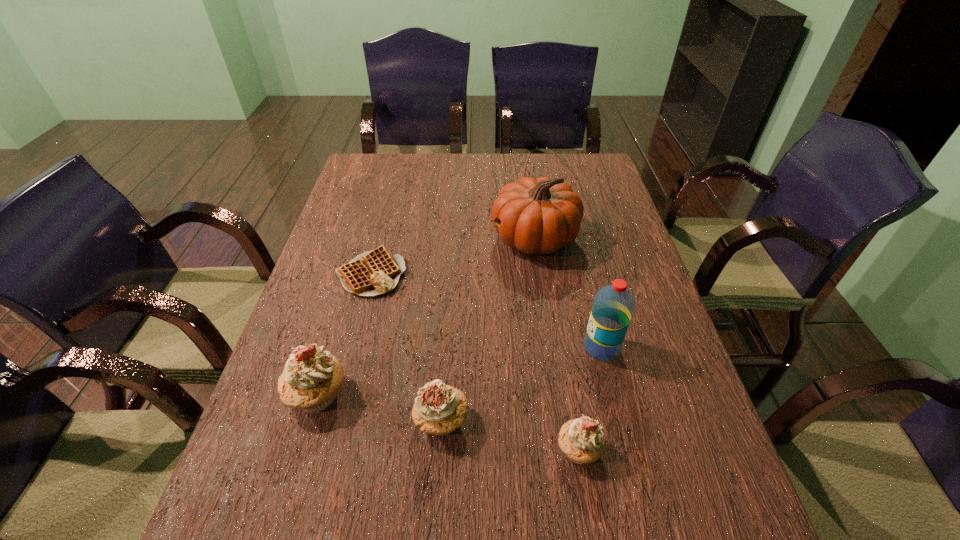
Find the location of a particular element. the tallest cupcake is located at coordinates (311, 379).

Image resolution: width=960 pixels, height=540 pixels. Identify the location of the fourth shortest object. (311, 379).

The width and height of the screenshot is (960, 540). Identify the location of the third object from left to right. (439, 409).

Find the location of a particular element. the third shortest object is located at coordinates click(x=439, y=409).

You are a GUI agent. You are given a task and a screenshot of the screen. Output one action in this format:
    pyautogui.click(x=<x>, y=<y>)
    Task: Click on the second shortest object
    
    Given the screenshot: What is the action you would take?
    pyautogui.click(x=582, y=440)

Locate an element on the screen. the shortest cupcake is located at coordinates (582, 440).

The width and height of the screenshot is (960, 540). I want to click on pumpkin, so click(541, 215).

Where is `the third farthest object`? The width and height of the screenshot is (960, 540). the third farthest object is located at coordinates point(613,306).

In order to click on waffle in this screenshot , I will do `click(375, 272)`.

This screenshot has height=540, width=960. What are the coordinates of `vacant space located 0.250m on the right of the third tallest object` in the screenshot? It's located at (466, 394).